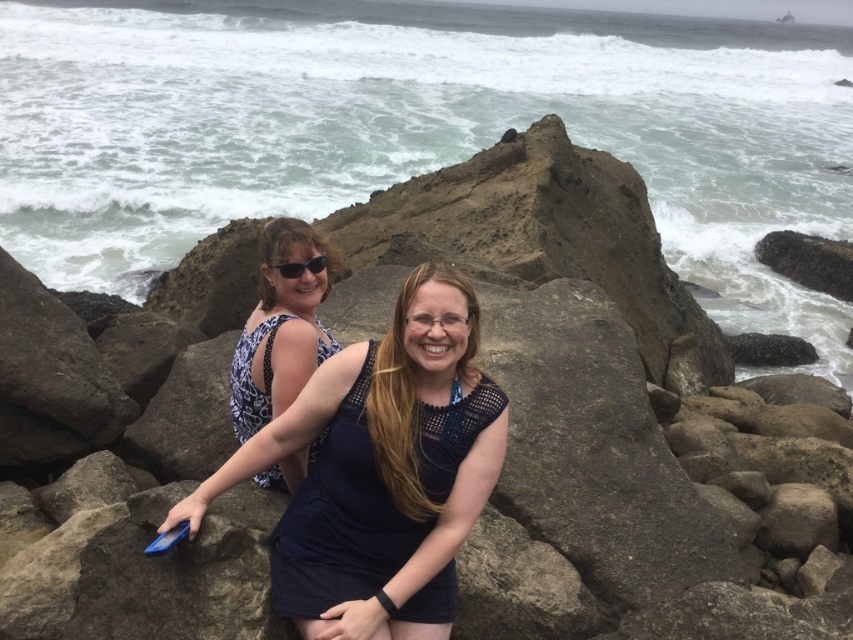
Describe the element at coordinates (280, 324) in the screenshot. The width and height of the screenshot is (853, 640). I see `blue dotted dress at center` at that location.

Which is behind, point (312, 253) or point (287, 273)?

The point (312, 253) is behind.

At what (x,y) coordinates should I click in order to perform the action: click on blue dotted dress at center. Please return your answer as a coordinate pair (x, y). This screenshot has height=640, width=853. Looking at the image, I should click on (280, 324).

Is dark blue fabric dress at center thinner than blue dotted dress at center?

No.

Looking at this image, can you confirm if dark blue fabric dress at center is smaller than blue dotted dress at center?

No.

Between point (314, 380) and point (247, 392), which one is positioned behind?

The point (247, 392) is more distant.

You are a GUI agent. You are given a task and a screenshot of the screen. Output one action in this format:
    pyautogui.click(x=<x>, y=<y>)
    Task: Click on the dark blue fabric dress at center
    
    Given the screenshot: What is the action you would take?
    pyautogui.click(x=381, y=472)

Can you confirm if dark blue fabric dress at center is wider than black plastic sunglasses at upper center?

Yes.

Is dark blue fabric dress at center further to camera compared to black plastic sunglasses at upper center?

No, it is not.

Is point (453, 493) more distant than point (312, 273)?

No, (453, 493) is closer to viewer.

Identify the location of dark blue fabric dress at center. Image resolution: width=853 pixels, height=640 pixels. (381, 472).